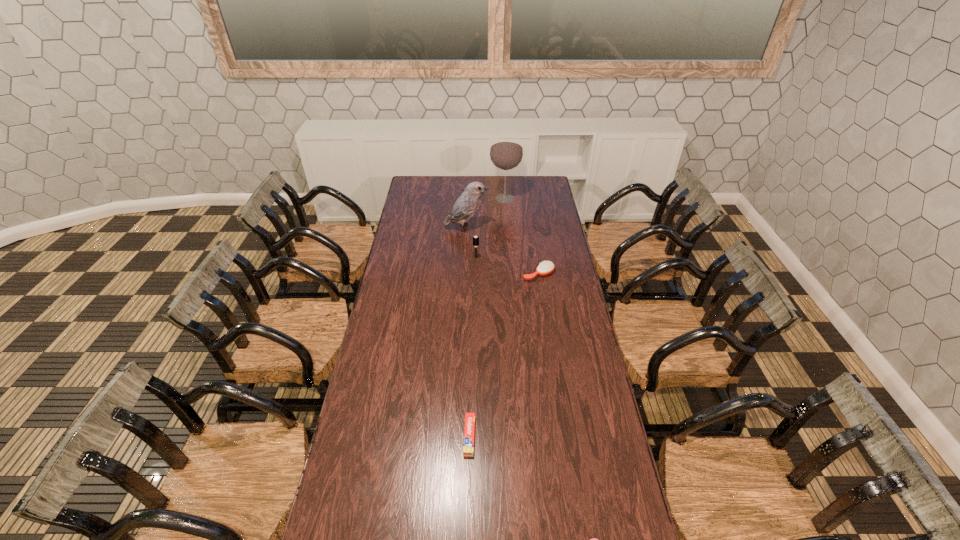
This screenshot has width=960, height=540. In the image, there is a desktop. Identify the location of vacant space at the far right corner. (530, 192).

Locate an element on the screen. free spot between the fifth tallest object and the third tallest object is located at coordinates (472, 347).

Where is `vacant space in between the tallest object and the toothpaste`? This screenshot has width=960, height=540. vacant space in between the tallest object and the toothpaste is located at coordinates (487, 318).

Identify the location of free space between the toothpaste and the fifth nearest object. The width and height of the screenshot is (960, 540). (468, 332).

Locate an element on the screen. free space between the parrot and the tallest hairbrush is located at coordinates (471, 243).

Find the location of a particular element. The height and width of the screenshot is (540, 960). unoccupied area between the leftmost hairbrush and the fifth tallest object is located at coordinates (472, 347).

Where is `free space between the third shortest object and the fifth farthest object`? This screenshot has width=960, height=540. free space between the third shortest object and the fifth farthest object is located at coordinates (504, 355).

At what (x,y) coordinates should I click in order to perform the action: click on free spot between the tallest hairbrush and the alcohol. Please return your answer as a coordinate pair (x, y). Image resolution: width=960 pixels, height=540 pixels. Looking at the image, I should click on (491, 228).

In order to click on the third closest object relative to the second nearest hairbrush in this screenshot , I will do `click(506, 153)`.

At what (x,y) coordinates should I click in order to perform the action: click on object that is the fourth closest to the tallest hairbrush. Please return your answer as a coordinate pair (x, y). Looking at the image, I should click on (468, 447).